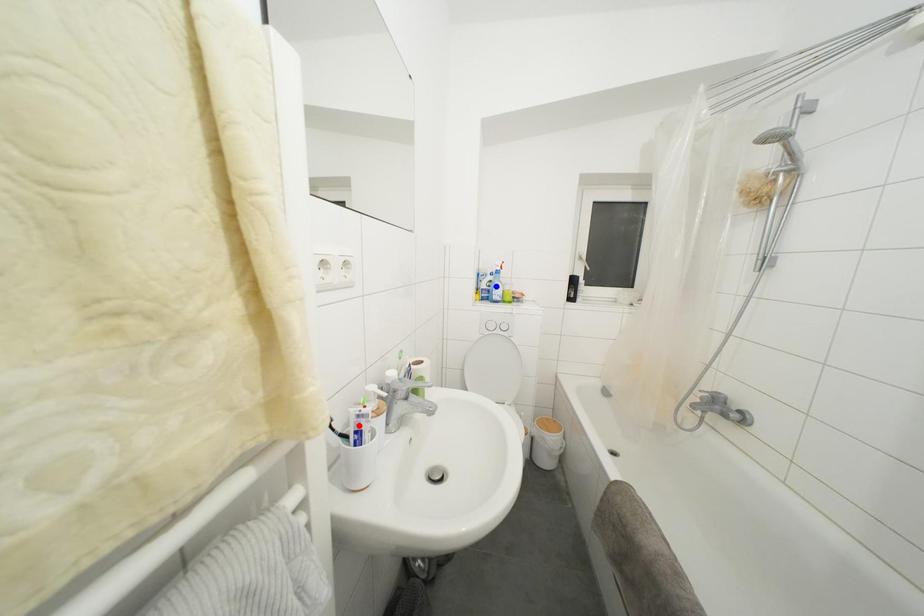
Question: In the image, two points are highlighted. Which point is nearer to the camera? Reply with the corresponding letter.

Choices:
 (A) blue point
 (B) red point

Answer: (B)